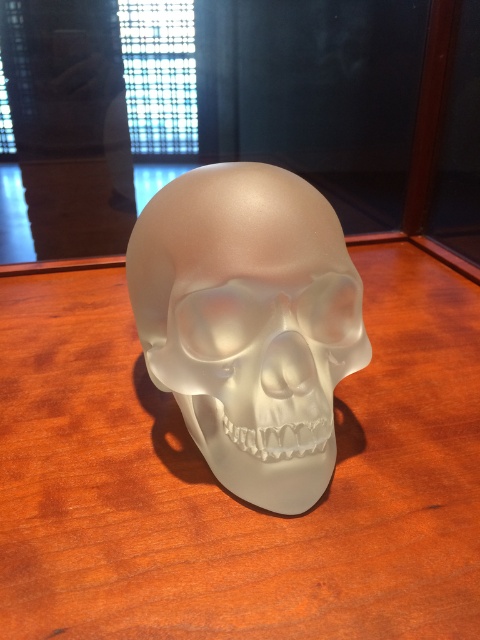
Looking at this image, does satin wood table at center have a lesser height compared to satin white skull at center?

Incorrect, satin wood table at center's height does not fall short of satin white skull at center's.

Can you confirm if satin wood table at center is bigger than satin white skull at center?

Correct, satin wood table at center is larger in size than satin white skull at center.

Find the location of a particular element. This screenshot has width=480, height=640. satin wood table at center is located at coordinates (228, 492).